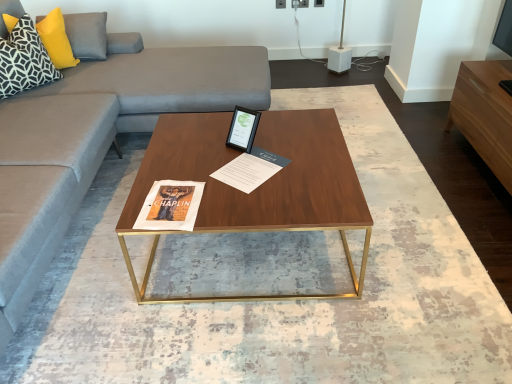
Identify the location of empty space that is to the right of matte paper magazine at center. (304, 163).